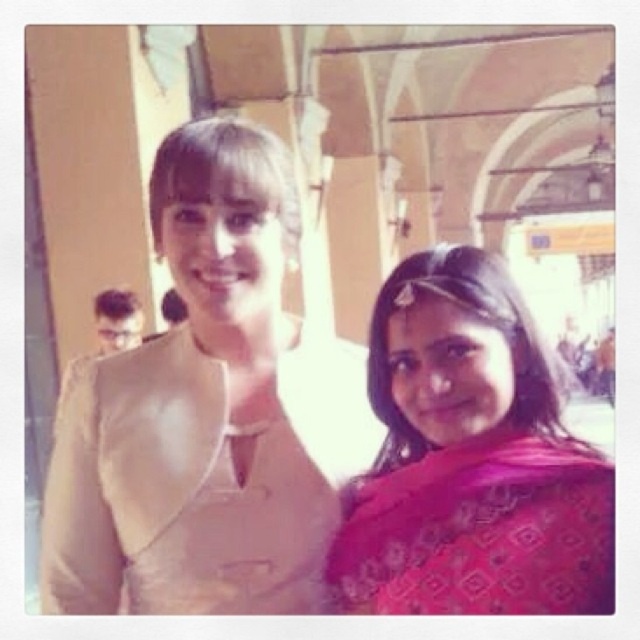
Based on the photo, you are an architect analyzing the spatial layout of the arch structure in the image. You need to determine the exact position of the pink printed saree at right relative to the arch structure. Can you identify its coordinates?

The pink printed saree at right is located at coordinates [472,458].